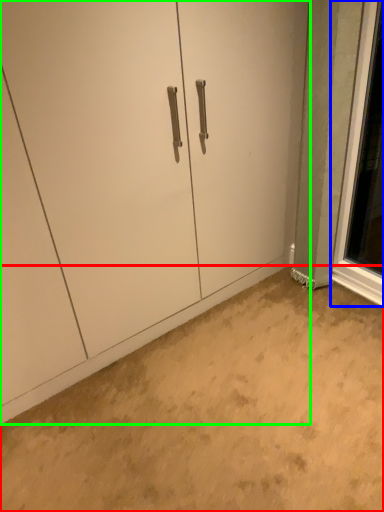
Question: Considering the real-world distances, which object is farthest from concrete (highlighted by a red box)? window (highlighted by a blue box) or door (highlighted by a green box)?

Choices:
 (A) window
 (B) door

Answer: (A)